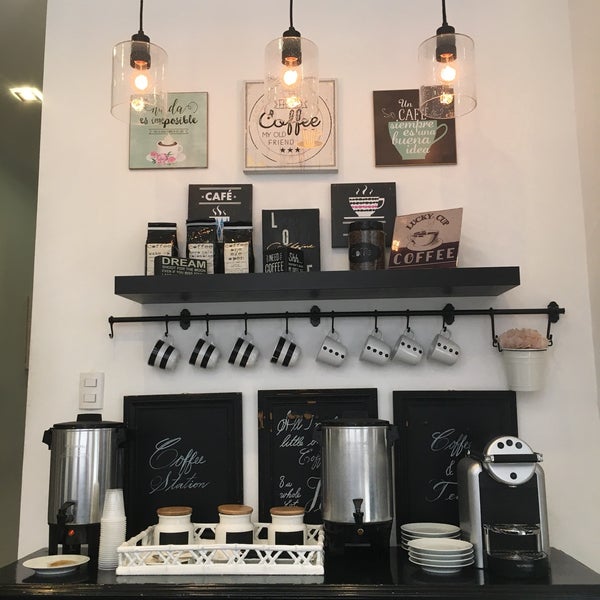
This screenshot has width=600, height=600. What are the coordinates of `white light switch panel` in the screenshot? It's located at (81, 377).